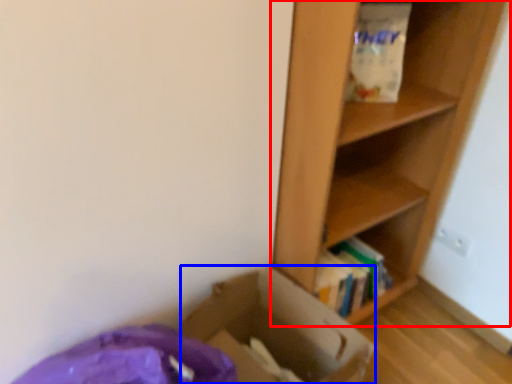
Question: Among these objects, which one is nearest to the camera, shelf (highlighted by a red box) or cardboard box (highlighted by a blue box)?

Choices:
 (A) shelf
 (B) cardboard box

Answer: (A)